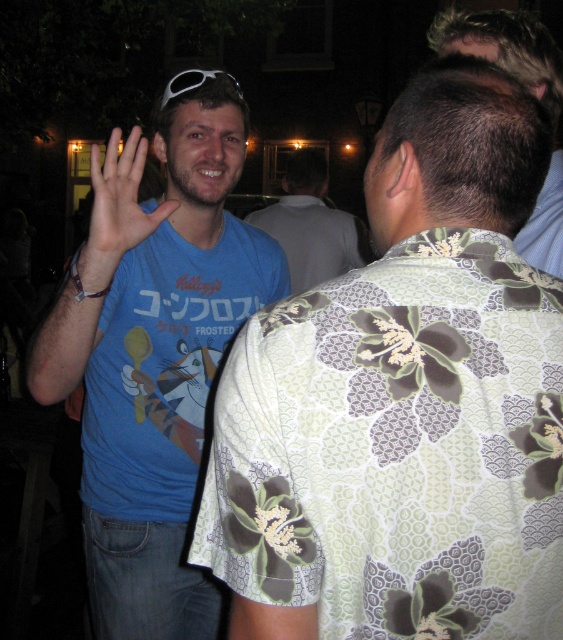
Does blue cotton t-shirt at left have a greater width compared to blue cotton shirt at center?

In fact, blue cotton t-shirt at left might be narrower than blue cotton shirt at center.

Between blue cotton t-shirt at left and blue cotton shirt at center, which one appears on the left side from the viewer's perspective?

blue cotton t-shirt at left is more to the left.

Does point (75, 365) lie in front of point (298, 168)?

Yes, it is.

What are the coordinates of `blue cotton t-shirt at left` in the screenshot? It's located at (154, 355).

Can you confirm if floral-patterned shirt at left is smaller than white plastic sunglasses at upper center?

Actually, floral-patterned shirt at left might be larger than white plastic sunglasses at upper center.

Can you confirm if floral-patterned shirt at left is wider than white plastic sunglasses at upper center?

Yes.

Where is `floral-patterned shirt at left`? The image size is (563, 640). floral-patterned shirt at left is located at coordinates (404, 401).

Find the location of a particular element. This screenshot has height=640, width=563. floral-patterned shirt at left is located at coordinates (404, 401).

Who is shorter, blue cotton t-shirt at left or matte blue shirt at center?

With less height is matte blue shirt at center.

Who is more distant from viewer, (140, 289) or (114, 182)?

The point (140, 289) is more distant.

Where is `blue cotton t-shirt at left`? This screenshot has width=563, height=640. blue cotton t-shirt at left is located at coordinates (154, 355).